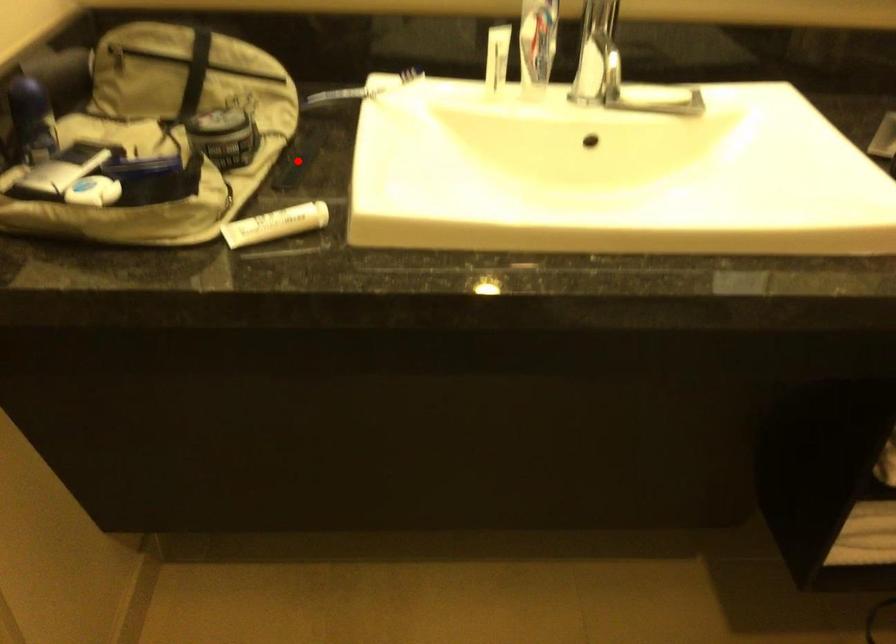
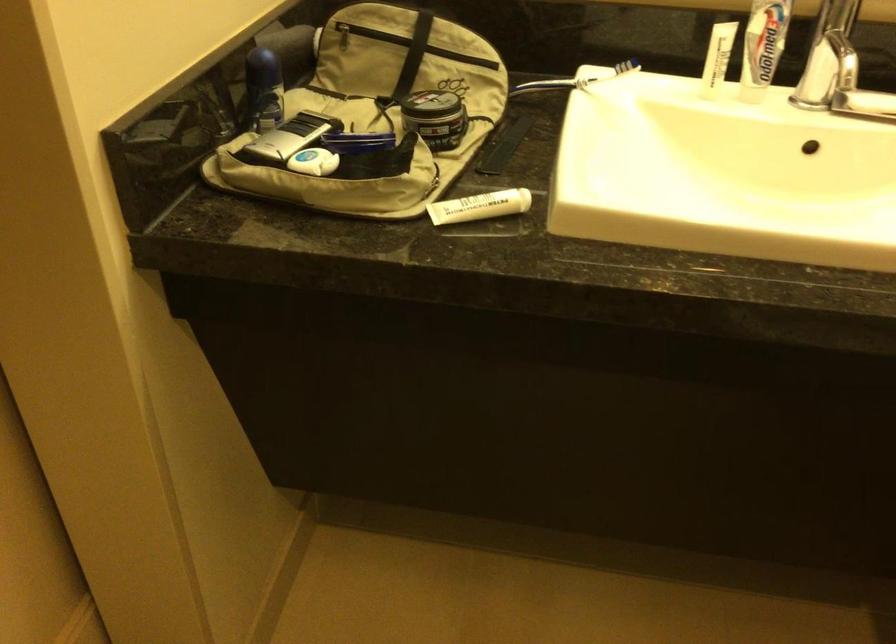
Where in the second image is the point corresponding to the highlighted location from the first image?

(503, 146)